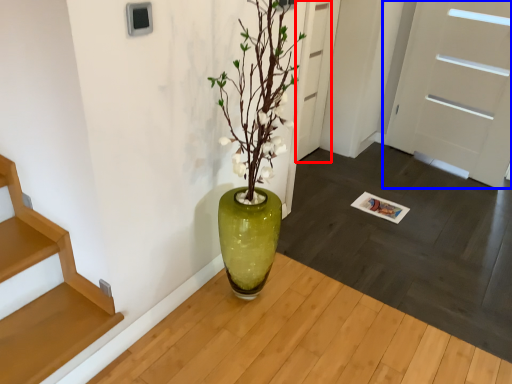
Question: Which object appears closest to the camera in this image, door (highlighted by a red box) or door (highlighted by a blue box)?

Choices:
 (A) door
 (B) door

Answer: (B)